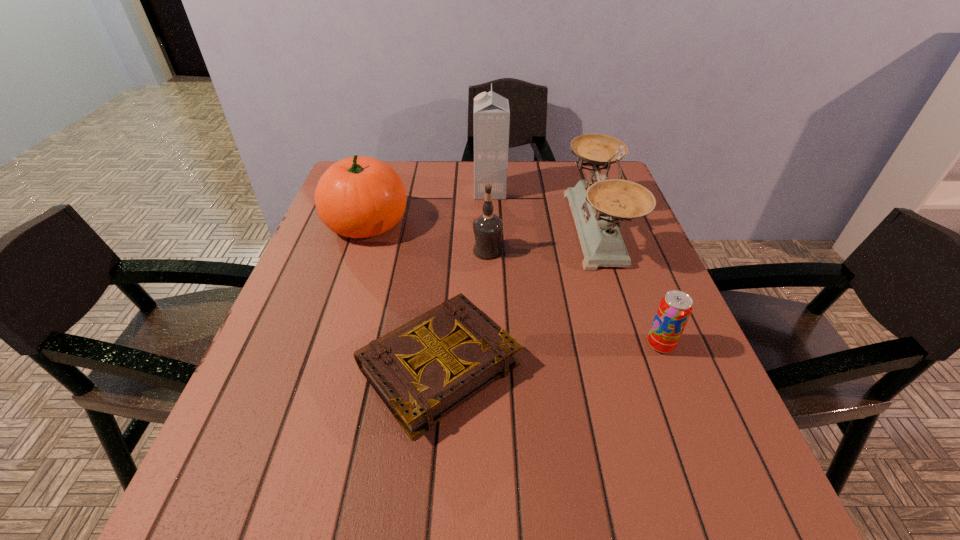
The height and width of the screenshot is (540, 960). I want to click on free spot located 0.070m on the front-facing side of the scale, so click(541, 230).

This screenshot has width=960, height=540. Find the location of `free space located 0.140m on the front-facing side of the scale`. free space located 0.140m on the front-facing side of the scale is located at coordinates (515, 230).

Find the location of a particular element. vacant space situated on the front of the pumpkin is located at coordinates tap(320, 366).

Where is `vacant space located on the front label of the vodka`? This screenshot has width=960, height=540. vacant space located on the front label of the vodka is located at coordinates (432, 251).

Where is `vacant space located 0.250m on the front label of the vodka`? vacant space located 0.250m on the front label of the vodka is located at coordinates point(371,251).

I want to click on vacant space situated 0.220m on the front label of the vodka, so click(383, 251).

This screenshot has width=960, height=540. Find the location of `free space located 0.380m on the left of the soda can`. free space located 0.380m on the left of the soda can is located at coordinates (452, 345).

At what (x,y) coordinates should I click in order to perform the action: click on free spot located on the front of the shortest object. Please return your answer as a coordinate pair (x, y). Image resolution: width=960 pixels, height=540 pixels. Looking at the image, I should click on (425, 521).

Where is `carton at the far edge`? The height and width of the screenshot is (540, 960). carton at the far edge is located at coordinates (491, 111).

Identify the location of scale located in the far edge section of the desktop. Image resolution: width=960 pixels, height=540 pixels. (598, 207).